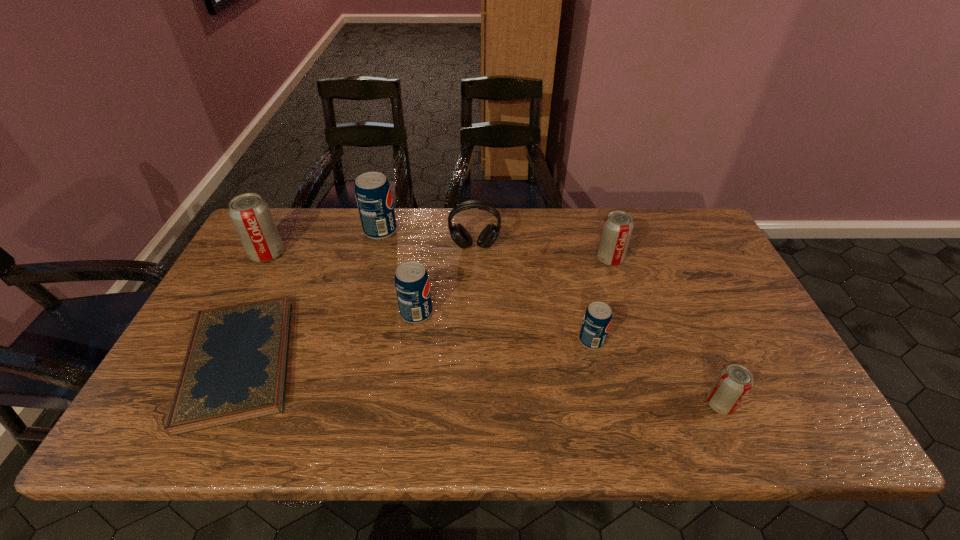
At what (x,y) coordinates should I click in order to perform the action: click on the nearest blue pop. Please return your answer as a coordinate pair (x, y). Image resolution: width=960 pixels, height=540 pixels. Looking at the image, I should click on (598, 316).

Where is `the third object from right to left`? the third object from right to left is located at coordinates (598, 316).

This screenshot has width=960, height=540. In order to click on the nearest soda can in this screenshot , I will do point(735,381).

In order to click on the smallest gray soda can in this screenshot , I will do `click(735, 381)`.

Find the location of a particular element. This screenshot has height=540, width=960. the shortest object is located at coordinates (235, 368).

What are the coordinates of `vacant region located on the left of the second soda can from left to right` in the screenshot? It's located at (343, 231).

In order to click on vacant space located on the right of the leftmost soda can in this screenshot , I will do `click(358, 254)`.

Find the location of a particular element. The width and height of the screenshot is (960, 540). vacant space located on the earcups of the gray headset is located at coordinates (473, 336).

Locate an element on the screen. Image resolution: width=960 pixels, height=540 pixels. vacant space situated 0.210m on the front of the fifth soda can from left to right is located at coordinates (630, 322).

Identify the location of free space located on the left of the fifth object from right to left. The width and height of the screenshot is (960, 540). (342, 313).